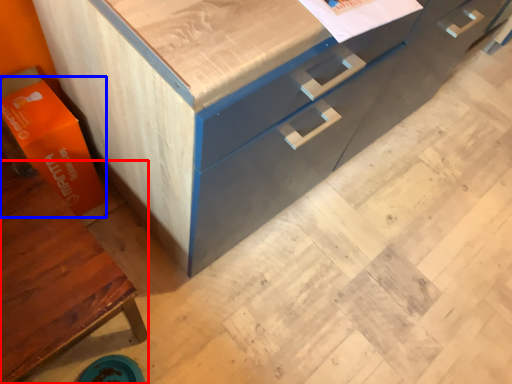
Question: Among these objects, which one is farthest to the camera, cabinetry (highlighted by a red box) or cardboard box (highlighted by a blue box)?

Choices:
 (A) cabinetry
 (B) cardboard box

Answer: (B)